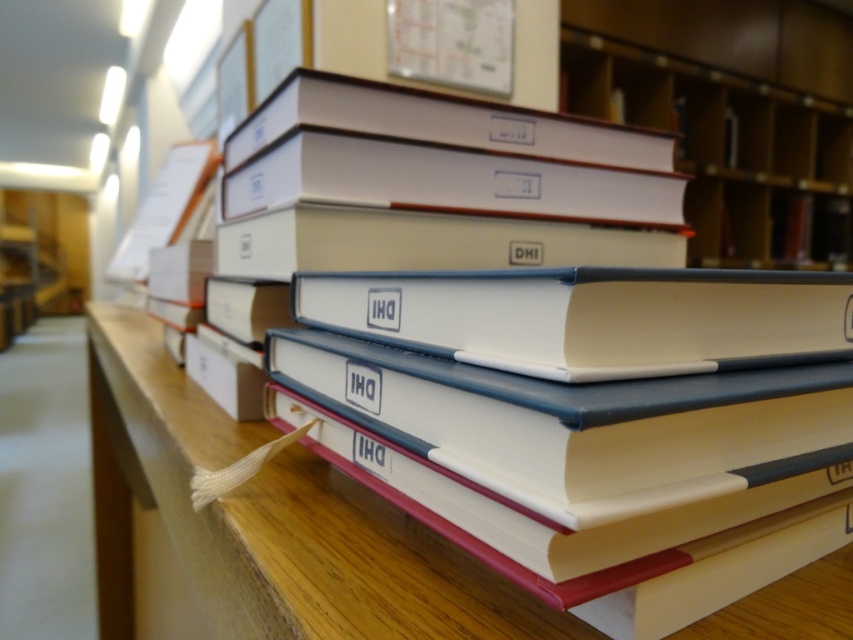
Question: Among these points, which one is farthest from the camera?

Choices:
 (A) (532, 612)
 (B) (601, 67)
 (C) (619, 280)

Answer: (B)

Question: Which point appears farthest from the camera in this image?

Choices:
 (A) (838, 307)
 (B) (801, 150)
 (C) (334, 554)

Answer: (B)

Question: In this image, where is wooden table at center located relative to white matte book at center?

Choices:
 (A) right
 (B) left

Answer: (B)

Question: Observing the image, what is the correct spatial positioning of wooden table at center in reference to white matte book at center?

Choices:
 (A) above
 (B) below

Answer: (B)

Question: Estimate the real-world distances between objects in this image. Which object is farther from the matte white book at upper center?

Choices:
 (A) white matte book at center
 (B) wooden table at center

Answer: (A)

Question: Is wooden table at center to the left of white matte book at center from the viewer's perspective?

Choices:
 (A) yes
 (B) no

Answer: (A)